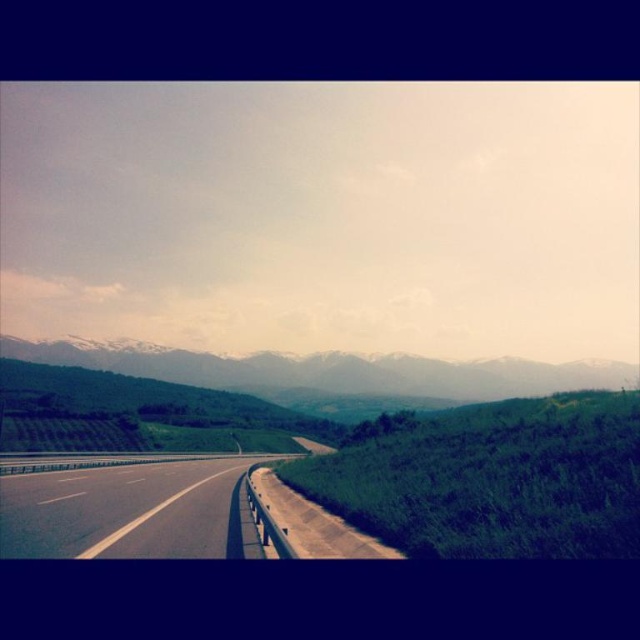
You are a landscape photographer planning to capture the entire scene. The green grassy hill at right and the snowy rock mountain at upper center are both in your viewfinder. Which of these two objects is narrower in width?

The green grassy hill at right is narrower in width than the snowy rock mountain at upper center.

You are a hiker planning to take a photo of both the green grassy hill at right and the snowy rock mountain at upper center. Which object should you position closer to the camera to ensure both are visible in the frame?

To ensure both the green grassy hill at right and the snowy rock mountain at upper center are visible in the frame, you should position the green grassy hill at right closer to the camera since it is smaller than the snowy rock mountain at upper center.

You are a drone operator planning to capture aerial footage of the green grassy hill at right and the black asphalt highway at center. From your current position, which one is higher in elevation?

The green grassy hill at right is above the black asphalt highway at center, so it is higher in elevation.